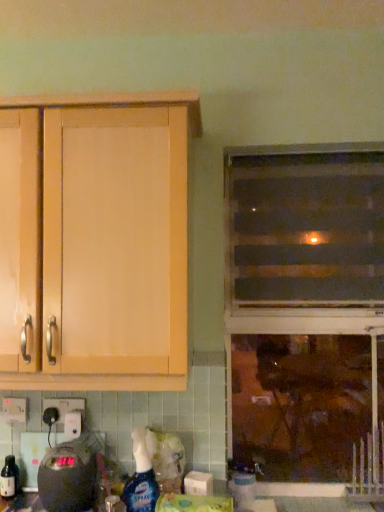
Question: From the image's perspective, is translucent plastic spray bottle at lower center located beneath light wood cabinet at upper left?

Choices:
 (A) yes
 (B) no

Answer: (A)

Question: Does translucent plastic spray bottle at lower center have a lesser height compared to light wood cabinet at upper left?

Choices:
 (A) no
 (B) yes

Answer: (B)

Question: Would you say light wood cabinet at upper left is part of translucent plastic spray bottle at lower center's contents?

Choices:
 (A) no
 (B) yes

Answer: (A)

Question: Is translucent plastic spray bottle at lower center positioned in front of light wood cabinet at upper left?

Choices:
 (A) yes
 (B) no

Answer: (B)

Question: Is translucent plastic spray bottle at lower center taller than light wood cabinet at upper left?

Choices:
 (A) no
 (B) yes

Answer: (A)

Question: Is translucent plastic screen door at upper right situated inside light wood cabinet at upper left or outside?

Choices:
 (A) outside
 (B) inside

Answer: (A)

Question: Is translucent plastic screen door at upper right wider or thinner than light wood cabinet at upper left?

Choices:
 (A) thin
 (B) wide

Answer: (A)

Question: From the image's perspective, is translucent plastic screen door at upper right above or below light wood cabinet at upper left?

Choices:
 (A) above
 (B) below

Answer: (A)

Question: In the image, is translucent plastic screen door at upper right positioned in front of or behind light wood cabinet at upper left?

Choices:
 (A) behind
 (B) front

Answer: (A)

Question: In terms of size, does black plastic scale at lower left appear bigger or smaller than transparent glass window at center?

Choices:
 (A) big
 (B) small

Answer: (B)

Question: From a real-world perspective, is black plastic scale at lower left above or below transparent glass window at center?

Choices:
 (A) below
 (B) above

Answer: (A)

Question: Considering the positions of point (97, 478) and point (329, 183), is point (97, 478) closer or farther from the camera than point (329, 183)?

Choices:
 (A) closer
 (B) farther

Answer: (A)

Question: Is black plastic scale at lower left in front of or behind transparent glass window at center in the image?

Choices:
 (A) behind
 (B) front

Answer: (B)

Question: Based on their positions, is translucent plastic spray bottle at lower center located to the left or right of translucent plastic screen door at upper right?

Choices:
 (A) left
 (B) right

Answer: (A)

Question: From a real-world perspective, is translucent plastic spray bottle at lower center positioned above or below translucent plastic screen door at upper right?

Choices:
 (A) below
 (B) above

Answer: (A)